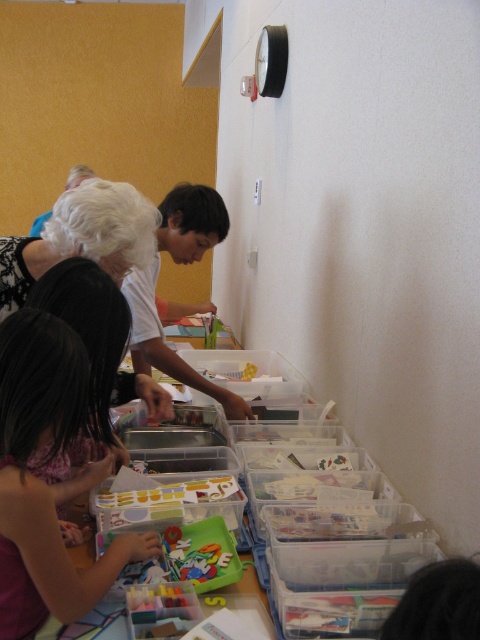
You are a fashion designer trying to arrange two dresses in a display window. The matte pink dress at lower left and the white lace dress at upper left. Which dress should you place on the lower shelf to ensure it stands out more due to its height?

The matte pink dress at lower left is much taller than the white lace dress at upper left, so placing it on the lower shelf will make it more visible and stand out due to its height.

You are a guest at a fashion show and see two dresses displayed on the table. The dresses are the matte pink dress at lower left and the white lace dress at upper left. Which dress is closer to you?

The matte pink dress at lower left is closer to you because it is in front of the white lace dress at upper left.

You are organizing a clothing donation drive and need to determine the spatial arrangement of two dresses in a closet. The dresses are the matte pink dress at lower left and the white lace dress at upper left. Which dress is placed higher in the closet?

The white lace dress at upper left is placed higher in the closet than the matte pink dress at lower left.